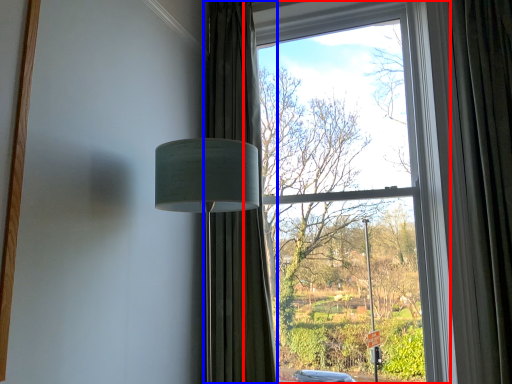
Question: Among these objects, which one is farthest to the camera, window (highlighted by a red box) or curtain (highlighted by a blue box)?

Choices:
 (A) window
 (B) curtain

Answer: (B)